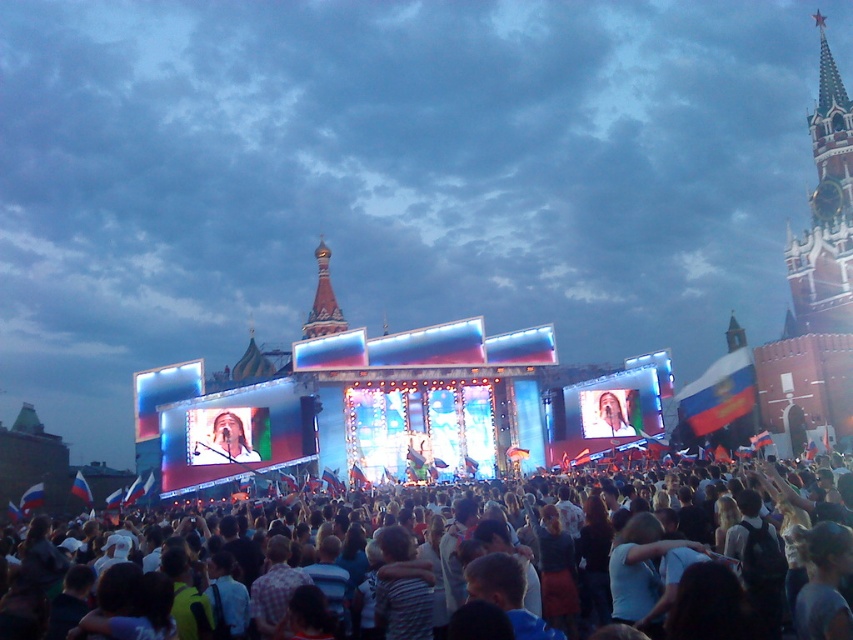
Question: Which object is the closest to the matte screen at center?

Choices:
 (A) shiny gold dome at center
 (B) matte white shirt at center

Answer: (B)

Question: Is matte black crowd at center thinner than matte white shirt at center?

Choices:
 (A) no
 (B) yes

Answer: (A)

Question: Estimate the real-world distances between objects in this image. Which object is closer to the shiny gold dome at center?

Choices:
 (A) matte black crowd at center
 (B) matte screen at center
 (C) matte white face at center
 (D) matte white shirt at center

Answer: (C)

Question: In this image, where is matte black crowd at center located relative to matte screen at center?

Choices:
 (A) left
 (B) right

Answer: (B)

Question: Is matte black crowd at center wider than matte white face at center?

Choices:
 (A) no
 (B) yes

Answer: (B)

Question: Which object is positioned closest to the matte black crowd at center?

Choices:
 (A) matte white face at center
 (B) shiny gold dome at center
 (C) matte white shirt at center
 (D) matte screen at center

Answer: (D)